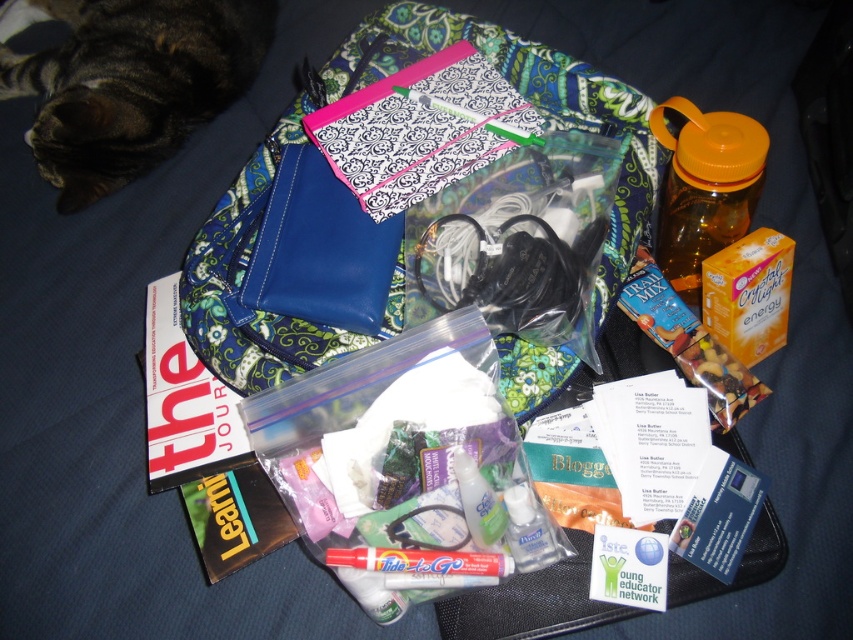
Question: Among these points, which one is farthest from the camera?

Choices:
 (A) (90, 132)
 (B) (656, 120)
 (C) (277, 317)

Answer: (A)

Question: Is tabby fur cat at upper left wider than orange plastic bottle at upper right?

Choices:
 (A) no
 (B) yes

Answer: (B)

Question: Estimate the real-world distances between objects in this image. Which object is farther from the clear plastic hand sanitizer at center?

Choices:
 (A) orange plastic bottle at upper right
 (B) tabby fur cat at upper left
 (C) matte blue pouch at center

Answer: (B)

Question: Which object is the closest to the matte blue pouch at center?

Choices:
 (A) clear gel at center
 (B) orange plastic bottle at upper right

Answer: (B)

Question: In this image, where is matte blue pouch at center located relative to orange plastic bottle at upper right?

Choices:
 (A) below
 (B) above

Answer: (B)

Question: Can you confirm if clear plastic hand sanitizer at center is bigger than clear gel at center?

Choices:
 (A) no
 (B) yes

Answer: (B)